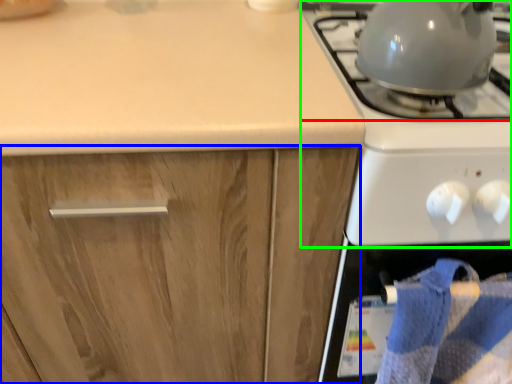
Question: Which object is positioned farthest from gas stove (highlighted by a red box)? Select from cabinetry (highlighted by a blue box) and gas stove (highlighted by a green box).

Choices:
 (A) cabinetry
 (B) gas stove

Answer: (A)